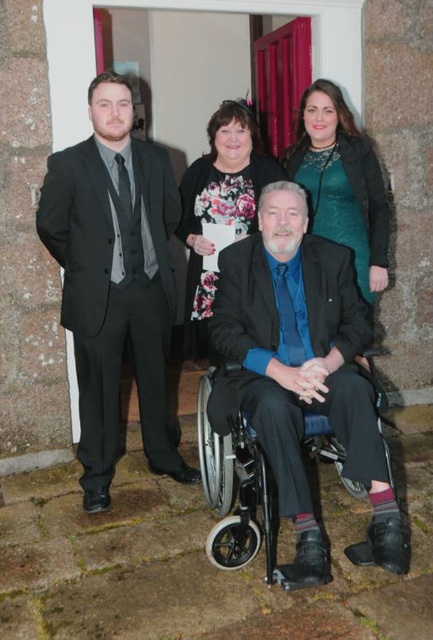
Question: Which is farther from the matte black wheelchair at center?

Choices:
 (A) teal satin dress at upper center
 (B) matte black suit at left
 (C) silver metallic wheelchair at center
 (D) floral fabric dress at upper center

Answer: (D)

Question: Can you confirm if silver metallic wheelchair at center is positioned to the right of floral fabric dress at upper center?

Choices:
 (A) no
 (B) yes

Answer: (B)

Question: Does matte black wheelchair at center appear under matte black suit at center?

Choices:
 (A) yes
 (B) no

Answer: (A)

Question: Does teal satin dress at upper center have a smaller size compared to floral fabric dress at upper center?

Choices:
 (A) no
 (B) yes

Answer: (B)

Question: Which of the following is the closest to the observer?

Choices:
 (A) (332, 163)
 (B) (381, 477)

Answer: (B)

Question: Among these points, which one is farthest from the camera?

Choices:
 (A) (200, 305)
 (B) (119, 285)
 (C) (329, 310)
 (D) (381, 241)

Answer: (A)